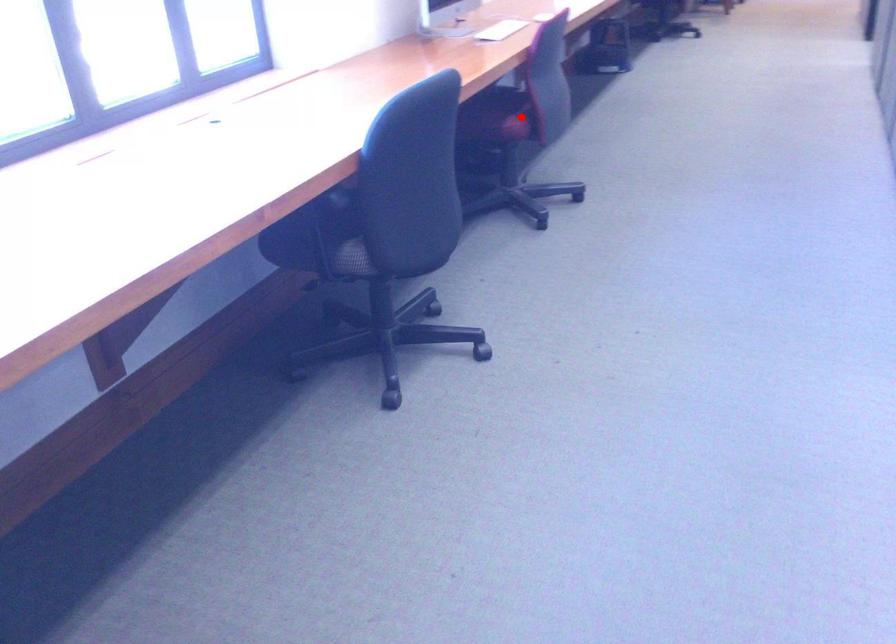
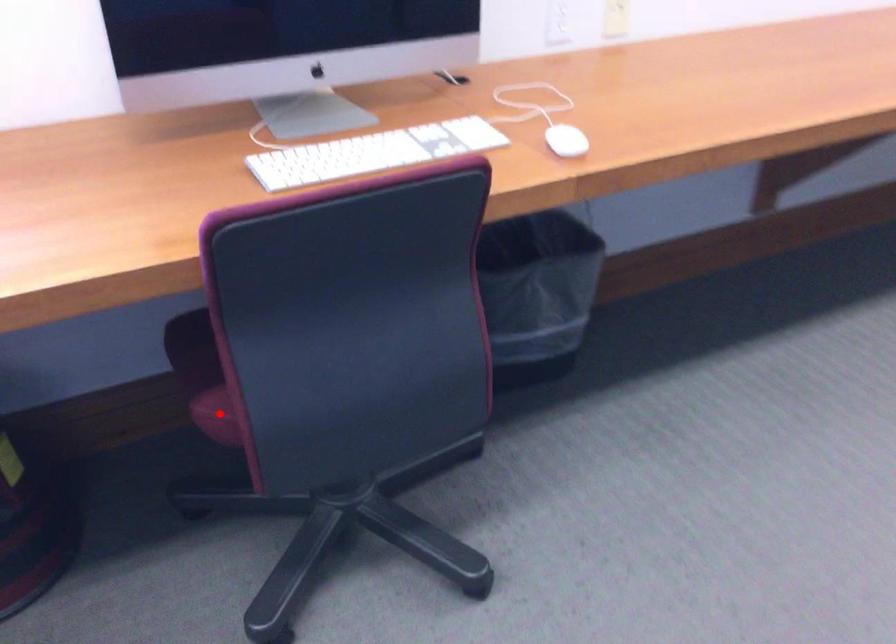
I am providing you with two images of the same scene from different viewpoints. A red point is marked on the first image and another point is marked on the second image. Is the red point in image1 aligned with the point shown in image2?

Yes